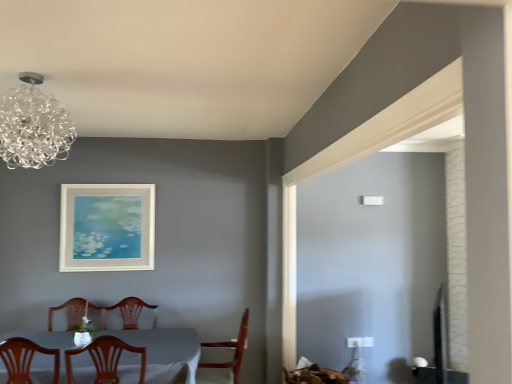
The height and width of the screenshot is (384, 512). In order to click on empty space that is ontop of white matte picture frame at upper center (from a real-world perspective) in this screenshot , I will do click(x=112, y=178).